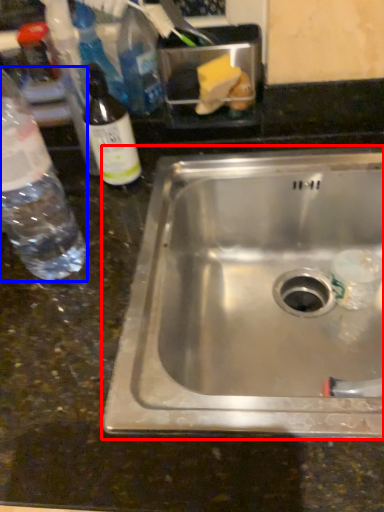
Question: Which of the following is the farthest to the observer, sink (highlighted by a red box) or bottle (highlighted by a blue box)?

Choices:
 (A) sink
 (B) bottle

Answer: (A)